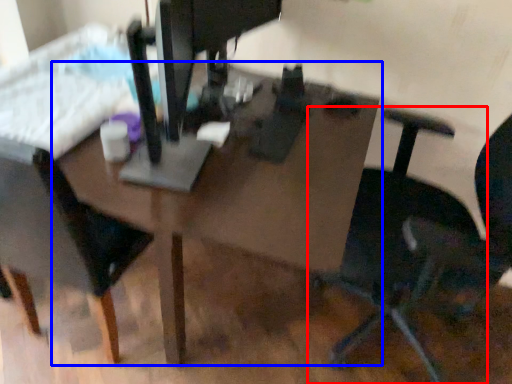
Question: Which object appears closest to the camera in this image, chair (highlighted by a red box) or table (highlighted by a blue box)?

Choices:
 (A) chair
 (B) table

Answer: (A)